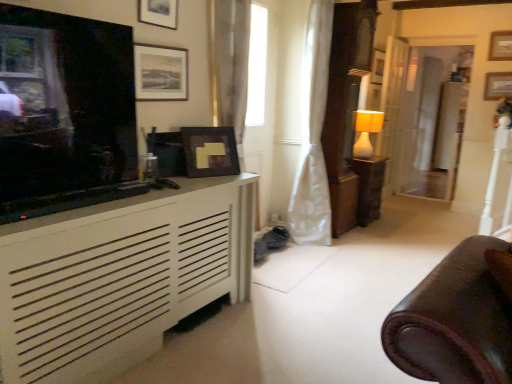
Question: Is matte black television at left bigger than matte black picture frame at upper center, the 2th picture frame in the front-to-back sequence?

Choices:
 (A) yes
 (B) no

Answer: (A)

Question: Is matte black television at left to the right of matte black picture frame at upper center, arranged as the fifth picture frame when viewed from the back, from the viewer's perspective?

Choices:
 (A) no
 (B) yes

Answer: (A)

Question: Is matte black television at left shorter than matte black picture frame at upper center, which is the first picture frame from left to right?

Choices:
 (A) no
 (B) yes

Answer: (A)

Question: Is matte black television at left completely or partially outside of matte black picture frame at upper center, the 6th picture frame when ordered from right to left?

Choices:
 (A) no
 (B) yes

Answer: (B)

Question: Is there a large distance between matte black television at left and matte black picture frame at upper center, the 6th picture frame when ordered from right to left?

Choices:
 (A) no
 (B) yes

Answer: (A)

Question: Can you confirm if matte black television at left is wider than matte black picture frame at upper center, which is the first picture frame from left to right?

Choices:
 (A) no
 (B) yes

Answer: (B)

Question: From a real-world perspective, is white wood door at center right positioned under matte black picture frame at upper center, the 6th picture frame when ordered from right to left, based on gravity?

Choices:
 (A) no
 (B) yes

Answer: (B)

Question: Is white wood door at center right surrounding matte black picture frame at upper center, which is the first picture frame from left to right?

Choices:
 (A) yes
 (B) no

Answer: (B)

Question: Considering the relative positions of white wood door at center right and matte black picture frame at upper center, arranged as the fifth picture frame when viewed from the back, in the image provided, is white wood door at center right to the right of matte black picture frame at upper center, arranged as the fifth picture frame when viewed from the back, from the viewer's perspective?

Choices:
 (A) yes
 (B) no

Answer: (A)

Question: Is white wood door at center right looking in the opposite direction of matte black picture frame at upper center, the 2th picture frame in the front-to-back sequence?

Choices:
 (A) no
 (B) yes

Answer: (A)

Question: Considering the relative positions of white wood door at center right and matte black picture frame at upper center, arranged as the fifth picture frame when viewed from the back, in the image provided, is white wood door at center right behind matte black picture frame at upper center, arranged as the fifth picture frame when viewed from the back,?

Choices:
 (A) yes
 (B) no

Answer: (A)

Question: Is white wood door at center right smaller than matte black picture frame at upper center, the 2th picture frame in the front-to-back sequence?

Choices:
 (A) yes
 (B) no

Answer: (B)

Question: From a real-world perspective, does white matte cabinet at left stand above white wood door at center right?

Choices:
 (A) yes
 (B) no

Answer: (B)